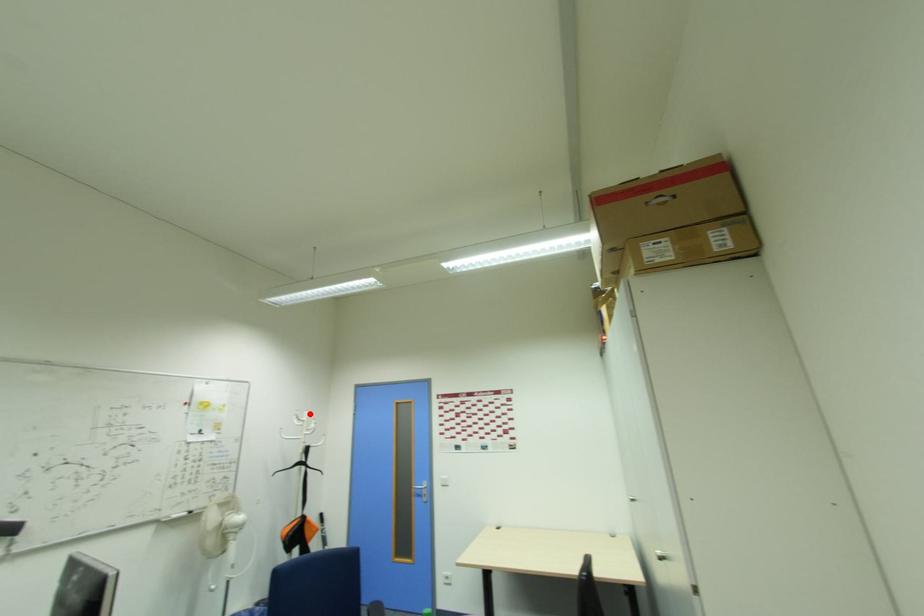
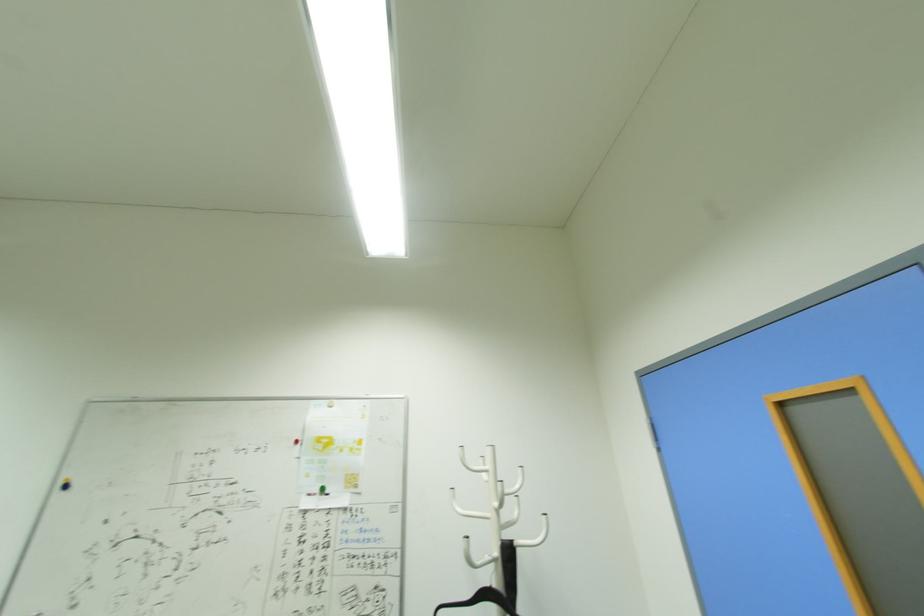
Locate, in the second image, the point that corresponds to the highlighted location in the first image.

(493, 451)